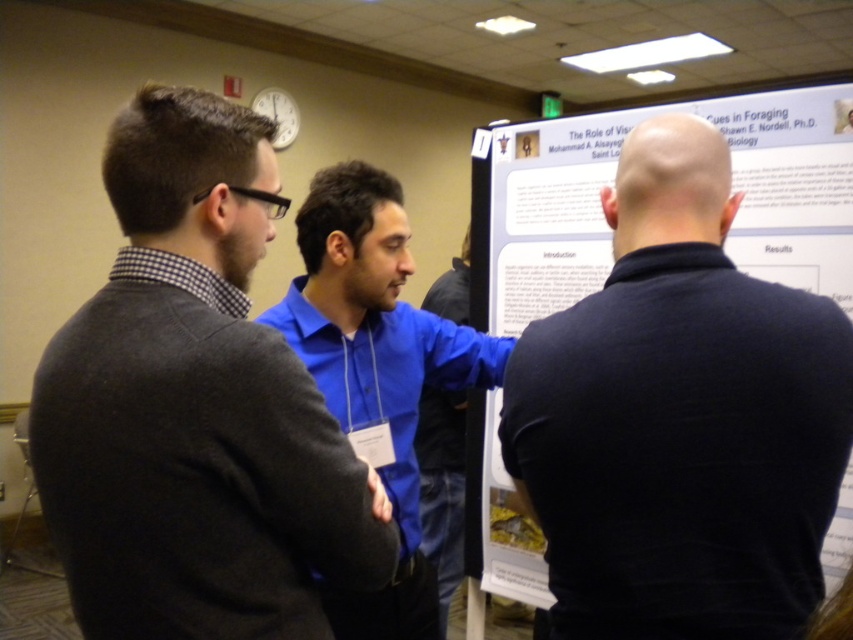
Does blue shirt at center have a larger size compared to blue smooth shirt at center?

Indeed, blue shirt at center has a larger size compared to blue smooth shirt at center.

Who is taller, blue shirt at center or blue smooth shirt at center?

blue shirt at center

What do you see at coordinates (376, 369) in the screenshot? I see `blue shirt at center` at bounding box center [376, 369].

Find the location of a particular element. blue shirt at center is located at coordinates (376, 369).

Does black matte shirt at center have a smaller size compared to blue shirt at center?

Correct, black matte shirt at center occupies less space than blue shirt at center.

Is black matte shirt at center shorter than blue shirt at center?

Correct, black matte shirt at center is not as tall as blue shirt at center.

Identify the location of black matte shirt at center. (680, 419).

In order to click on black matte shirt at center in this screenshot , I will do `click(680, 419)`.

How far apart are dark gray sweater at left and black matte shirt at center?

A distance of 14.71 inches exists between dark gray sweater at left and black matte shirt at center.

Describe the element at coordinates (195, 406) in the screenshot. This screenshot has height=640, width=853. I see `dark gray sweater at left` at that location.

This screenshot has width=853, height=640. I want to click on dark gray sweater at left, so click(195, 406).

Image resolution: width=853 pixels, height=640 pixels. Find the location of `dark gray sweater at left`. dark gray sweater at left is located at coordinates (195, 406).